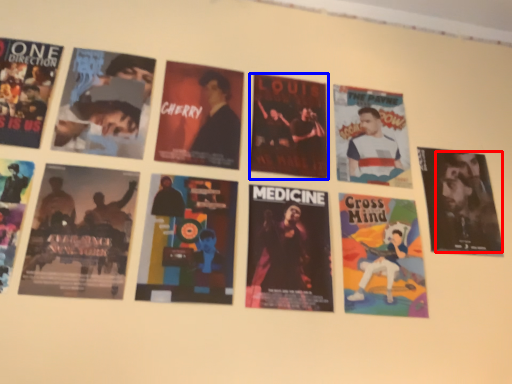
Question: Among these objects, which one is nearest to the camera, person (highlighted by a red box) or poster (highlighted by a blue box)?

Choices:
 (A) person
 (B) poster

Answer: (B)